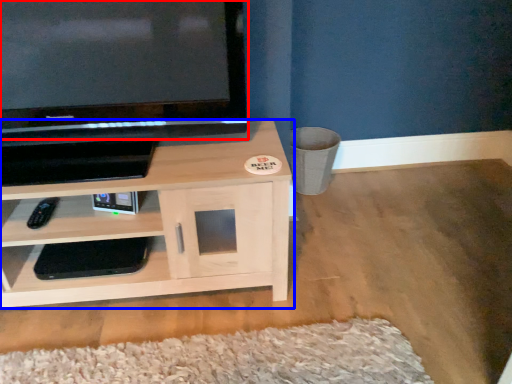
Question: Which object is closer to the camera taking this photo, television (highlighted by a red box) or shelf (highlighted by a blue box)?

Choices:
 (A) television
 (B) shelf

Answer: (A)